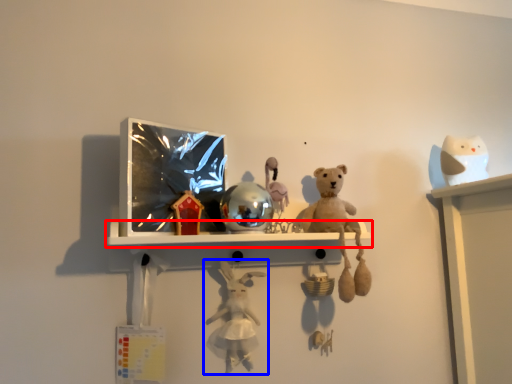
Question: Among these objects, which one is farthest to the camera, shelf (highlighted by a red box) or toy (highlighted by a blue box)?

Choices:
 (A) shelf
 (B) toy

Answer: (B)